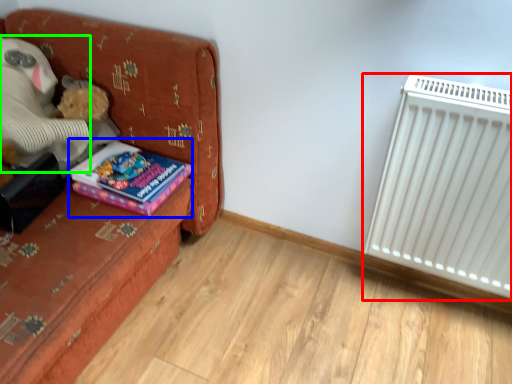
Question: Considering the real-world distances, which object is farthest from radiator (highlighted by a red box)? book (highlighted by a blue box) or teddy (highlighted by a green box)?

Choices:
 (A) book
 (B) teddy

Answer: (B)